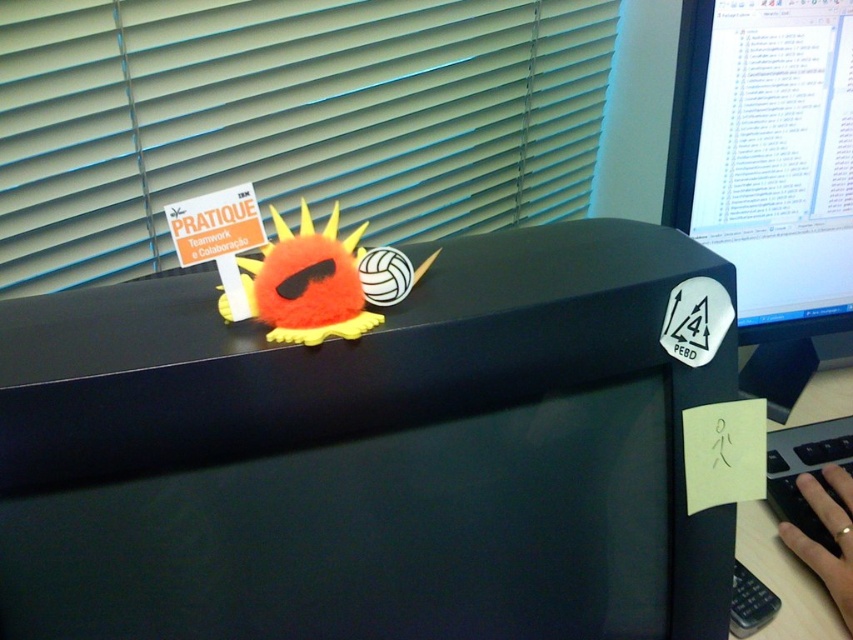
You are standing in front of a desk with a computer monitor. There are two points marked on the desk. The first point is at coordinates point (213, 296) and the second point is at point (819, 540). Which point is closer to you?

Point (213, 296) is closer to the viewer than point (819, 540).

You are organizing a small event and need to place a 20cm wide decoration on the desk. Given the black matte desk at center and the black plastic keyboard at lower right, can you confirm if there is enough space on the desk to accommodate the decoration?

The black matte desk at center has a larger width than the black plastic keyboard at lower right. Since the desk is wider, there should be sufficient space to place the 20cm wide decoration on the desk.